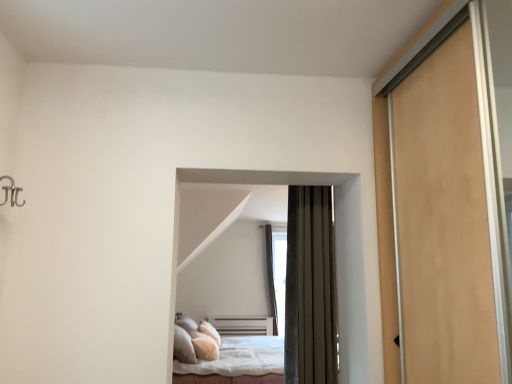
Question: Does dark brown fabric bed at center, which is the 2th bed from bottom to top, contain white soft bed at center, positioned as the 1th bed in back-to-front order?

Choices:
 (A) no
 (B) yes

Answer: (A)

Question: Is dark brown fabric bed at center, which ranks as the first bed in front-to-back order, oriented towards white soft bed at center, which appears as the second bed when viewed from the top?

Choices:
 (A) yes
 (B) no

Answer: (A)

Question: Are dark brown fabric bed at center, the 1th bed viewed from the top, and white soft bed at center, which appears as the second bed when viewed from the top, beside each other?

Choices:
 (A) yes
 (B) no

Answer: (B)

Question: Is dark brown fabric bed at center, which is the 2th bed from bottom to top, positioned far away from white soft bed at center, positioned as the 1th bed in back-to-front order?

Choices:
 (A) no
 (B) yes

Answer: (B)

Question: Is dark brown fabric bed at center, which is the 2th bed from bottom to top, taller than white soft bed at center, marked as the first bed in a bottom-to-top arrangement?

Choices:
 (A) no
 (B) yes

Answer: (A)

Question: Is dark brown fabric bed at center, which ranks as the 2th bed in back-to-front order, positioned behind white soft bed at center, positioned as the 1th bed in back-to-front order?

Choices:
 (A) yes
 (B) no

Answer: (B)

Question: Are transparent glass window at center and dark brown fabric bed at center, which is the 2th bed from bottom to top, beside each other?

Choices:
 (A) yes
 (B) no

Answer: (B)

Question: From a real-world perspective, is transparent glass window at center located higher than dark brown fabric bed at center, which ranks as the 2th bed in back-to-front order?

Choices:
 (A) yes
 (B) no

Answer: (B)

Question: From the image's perspective, is transparent glass window at center located beneath dark brown fabric bed at center, which ranks as the first bed in front-to-back order?

Choices:
 (A) yes
 (B) no

Answer: (A)

Question: Considering the relative positions of transparent glass window at center and dark brown fabric bed at center, the 1th bed viewed from the top, in the image provided, is transparent glass window at center behind dark brown fabric bed at center, the 1th bed viewed from the top,?

Choices:
 (A) yes
 (B) no

Answer: (A)

Question: Is transparent glass window at center not inside dark brown fabric bed at center, which ranks as the 2th bed in back-to-front order?

Choices:
 (A) no
 (B) yes

Answer: (B)

Question: Can you confirm if transparent glass window at center is positioned to the right of dark brown fabric bed at center, which ranks as the 2th bed in back-to-front order?

Choices:
 (A) no
 (B) yes

Answer: (B)

Question: From a real-world perspective, is dark brown fabric bed at center, which is the 2th bed from bottom to top, below transparent glass window at center?

Choices:
 (A) no
 (B) yes

Answer: (A)